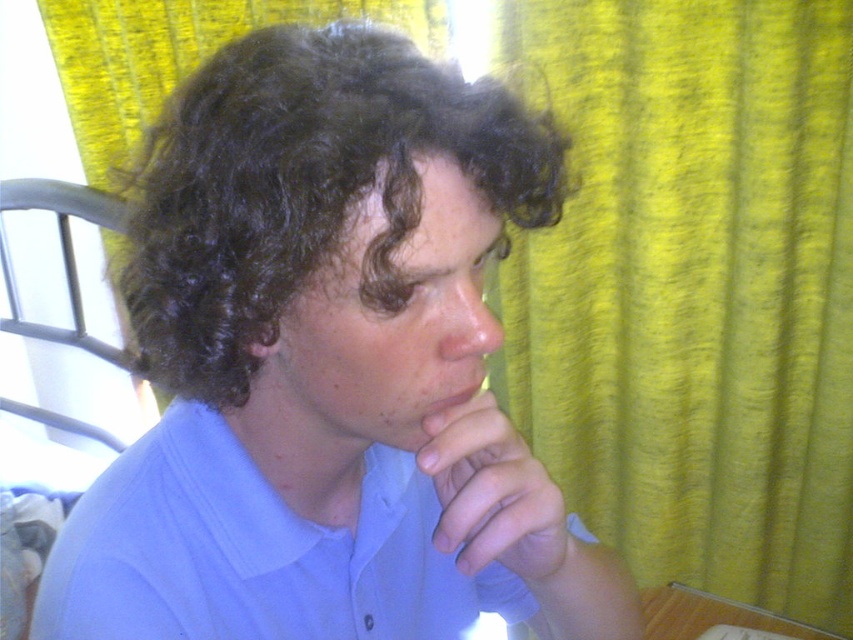
You are an interior designer analyzing the placement of objects in this room. The blue cotton shirt at center is positioned at coordinates 0.573 on the x and 0.385 on the y. If the room has a coordinate system where the bottom left corner is 0,0 and the top right corner is 1,1, which direction from the shirt would the bright yellow curtain be?

The bright yellow curtain is on the right side of the frame. Since the blue cotton shirt at center is located at coordinates (328, 365), and the coordinate system starts at the bottom left corner as (0, 0), the yellow curtain would be to the right of the shirt.

You are taking a photo of the scene and want to focus on the point at coordinate point (497, 518) and point (698, 625). Which point should you adjust your focus to first if you want to ensure both points are in focus?

You should focus on point (497, 518) first because it is closer to the camera than point (698, 625). By focusing on the closer point, the farther point may still be within the depth of field, ensuring both are in focus.

You are standing in a room with a bright yellow curtain on the right and a metallic bed frame on the left. There are two points marked in the image. If you were to walk straight forward, which point would you encounter first, point (405,301) or point (572,528)?

Point (405,301) is in front of point (572,528), so you would encounter point (405,301) first when moving forward.